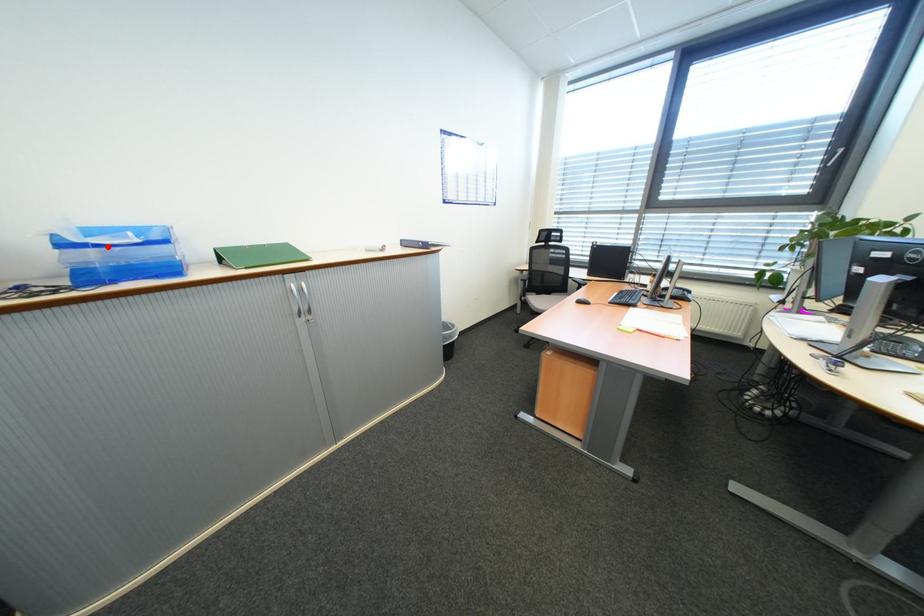
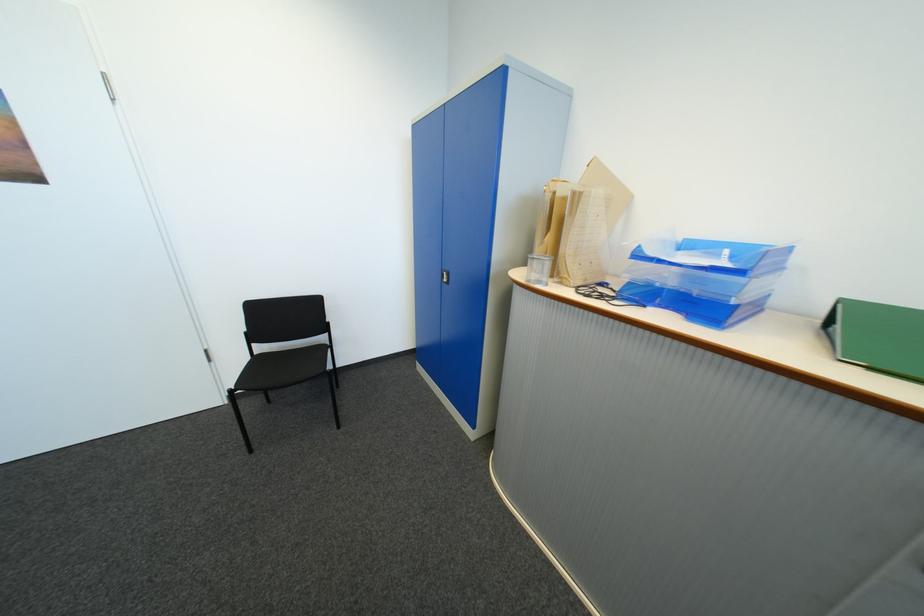
Question: I am providing you with two images of the same scene from different viewpoints. A red point is marked on the first image. At the location where the point appears in image 1, is it still visible in image 2?

Choices:
 (A) Yes
 (B) No

Answer: (A)